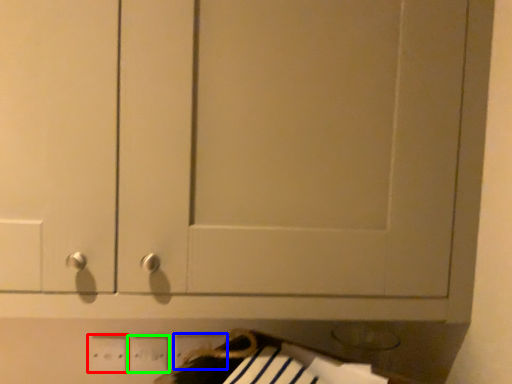
Question: Estimate the real-world distances between objects in this image. Which object is closer to electric outlet (highlighted by a red box), electric outlet (highlighted by a blue box) or electric outlet (highlighted by a green box)?

Choices:
 (A) electric outlet
 (B) electric outlet

Answer: (B)